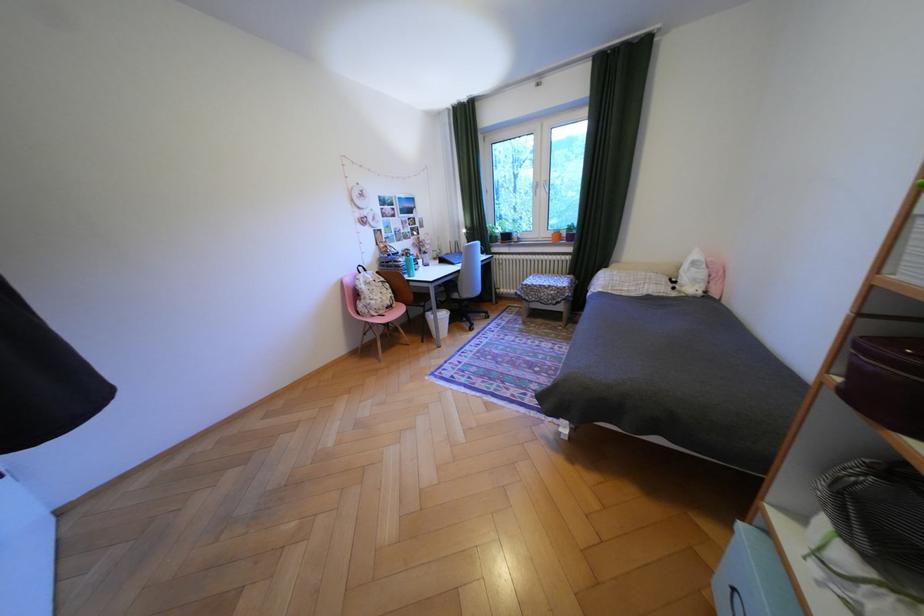
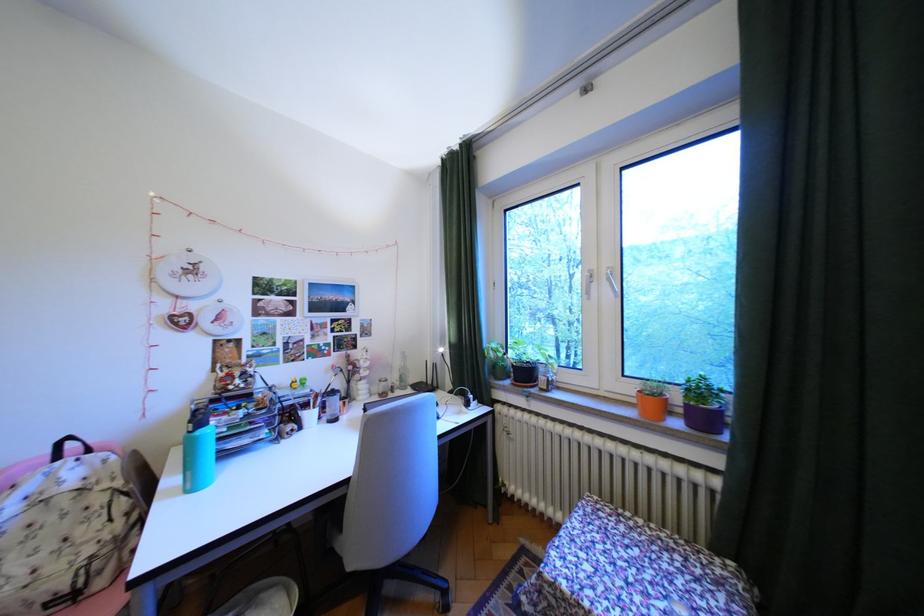
Find the pixel in the second image that matches (470,272) in the first image.

(359, 483)